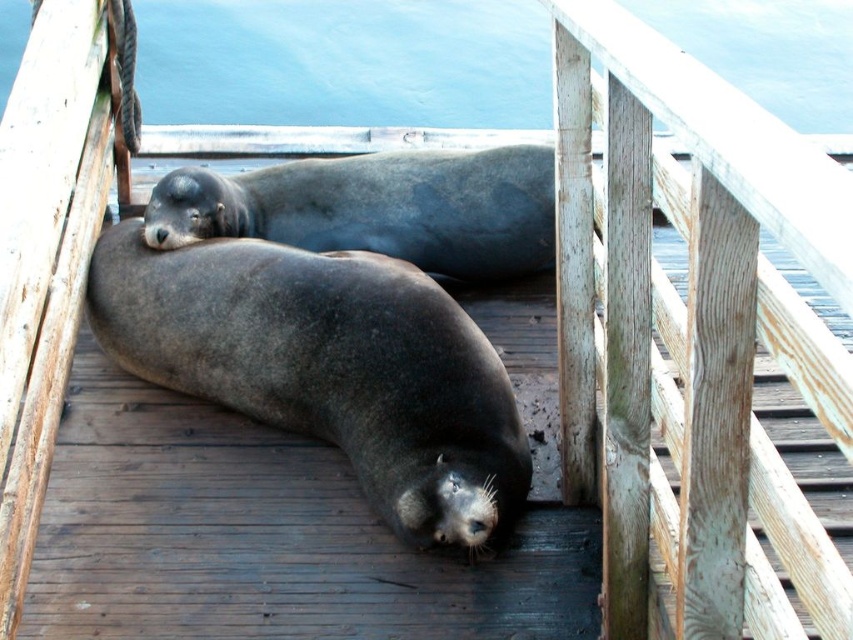
You are a photographer trying to capture the sea lions on the pier. You need to ensure that the weathered wood rail at upper center and the blue water at upper center are both visible in your shot. Given their sizes, which object should you focus on to ensure both are in frame?

The weathered wood rail at upper center is thinner than the blue water at upper center. To ensure both are in frame, focus on the weathered wood rail at upper center since it is smaller and requires less space, allowing the blue water at upper center to also fit into the shot.

You are a photographer trying to capture the sea lions on the pier. You notice the weathered wood rail at upper center and the blue water at upper center in your viewfinder. Which object will appear closer to you in the photo?

The weathered wood rail at upper center will appear closer to you in the photo because it is positioned in front of the blue water at upper center.

You are standing on the wooden pier where the sea lions are resting. You want to look at the blue water at upper center. Which direction should you move relative to the weathered wood rail at upper center?

To look at the blue water at upper center, you should move above the weathered wood rail at upper center because the blue water at upper center is located above it.